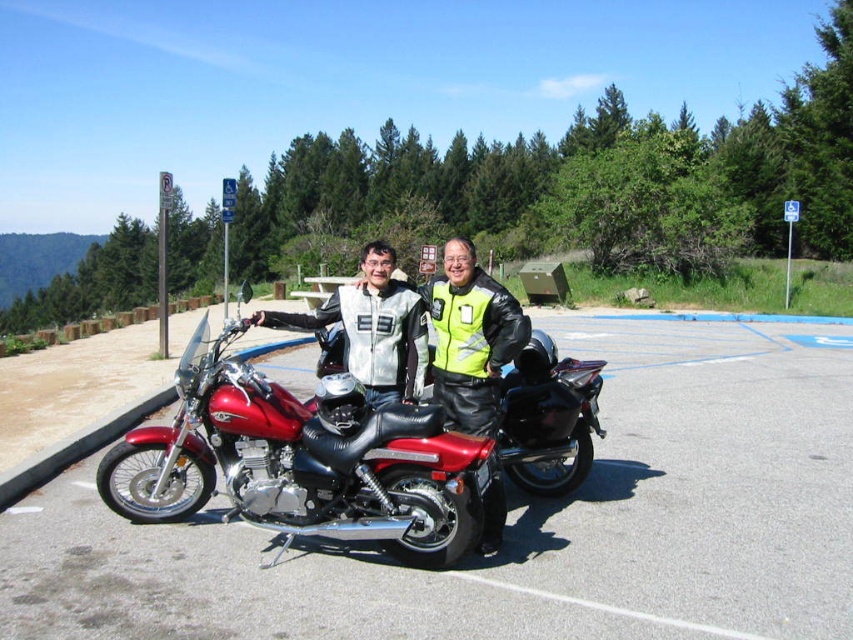
Is metallic red motorcycle at center to the left of matte black motorcycle at center from the viewer's perspective?

In fact, metallic red motorcycle at center is to the right of matte black motorcycle at center.

Is metallic red motorcycle at center taller than matte black motorcycle at center?

No, metallic red motorcycle at center is not taller than matte black motorcycle at center.

The width and height of the screenshot is (853, 640). In order to click on metallic red motorcycle at center in this screenshot , I will do `click(521, 522)`.

Which is above, shiny red motorcycle at center or matte black motorcycle at center?

Positioned higher is matte black motorcycle at center.

Is point (477, 467) more distant than point (468, 340)?

No, (477, 467) is in front of (468, 340).

Where is `shiny red motorcycle at center`? shiny red motorcycle at center is located at coordinates (305, 461).

From the picture: Can you confirm if metallic red motorcycle at center is bigger than shiny red motorcycle at center?

Correct, metallic red motorcycle at center is larger in size than shiny red motorcycle at center.

The height and width of the screenshot is (640, 853). What do you see at coordinates (521, 522) in the screenshot? I see `metallic red motorcycle at center` at bounding box center [521, 522].

What do you see at coordinates (521, 522) in the screenshot? This screenshot has height=640, width=853. I see `metallic red motorcycle at center` at bounding box center [521, 522].

Locate an element on the screen. The width and height of the screenshot is (853, 640). metallic red motorcycle at center is located at coordinates (521, 522).